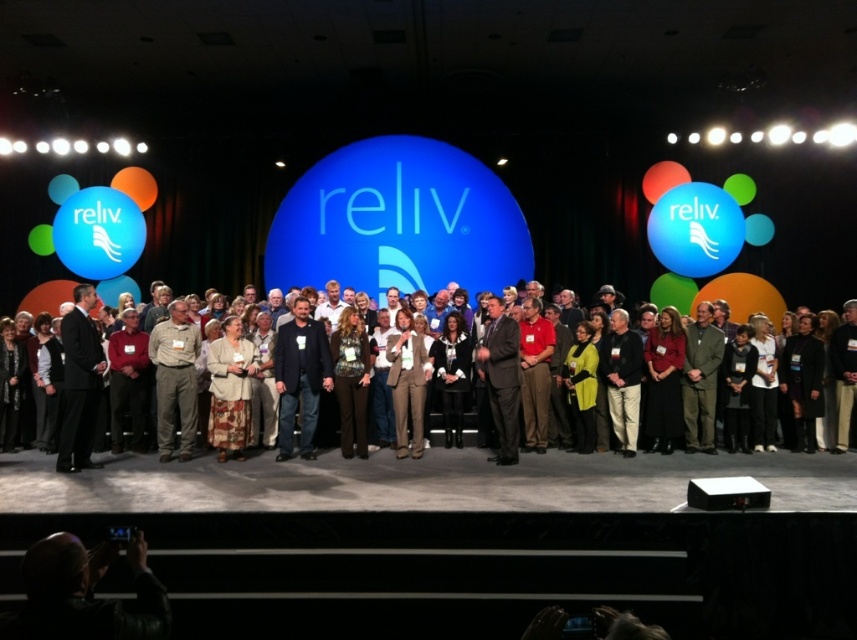
Question: Which object is the closest to the dark blue jeans at center?

Choices:
 (A) khaki pants at center
 (B) dark brown leather jacket at center

Answer: (A)

Question: Among these objects, which one is nearest to the camera?

Choices:
 (A) dark blue jeans at center
 (B) dark brown leather jacket at center

Answer: (A)

Question: Can you confirm if khaki pants at center is smaller than dark brown leather jacket at center?

Choices:
 (A) yes
 (B) no

Answer: (B)

Question: Is dark blue jeans at center to the right of khaki pants at center from the viewer's perspective?

Choices:
 (A) no
 (B) yes

Answer: (B)

Question: Is dark blue jeans at center thinner than dark brown leather jacket at center?

Choices:
 (A) no
 (B) yes

Answer: (A)

Question: Which point appears farthest from the camera in this image?

Choices:
 (A) (180, 320)
 (B) (330, 422)

Answer: (B)